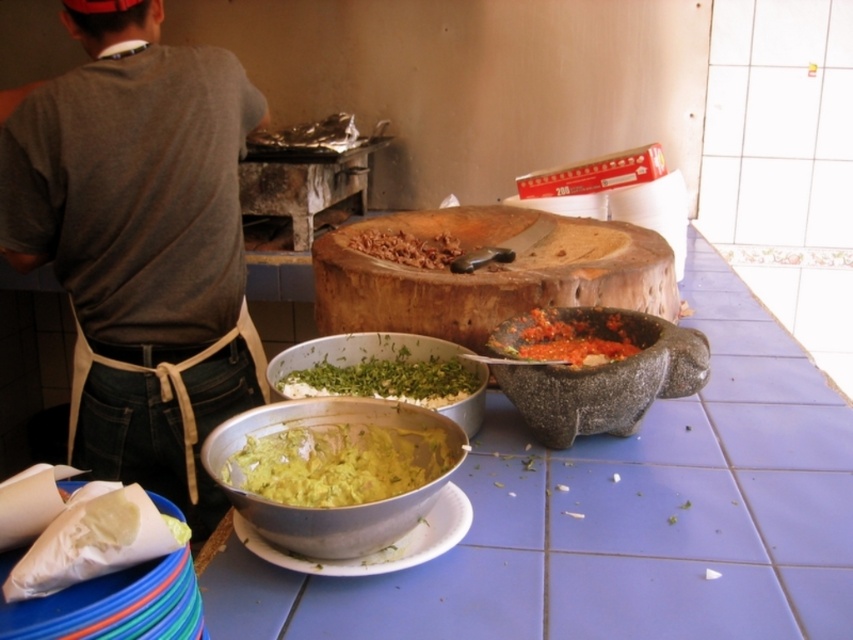
Question: Can you confirm if metallic silver bowl at center is thinner than white matte plate at center?

Choices:
 (A) yes
 (B) no

Answer: (B)

Question: Can you confirm if blue tile table at center is smaller than white matte plate at center?

Choices:
 (A) yes
 (B) no

Answer: (B)

Question: Can you confirm if yellowish-green paste at center is positioned above tomato paste stone mortar at center?

Choices:
 (A) yes
 (B) no

Answer: (B)

Question: Which of the following is the closest to the observer?

Choices:
 (A) blue tile table at center
 (B) metallic silver bowl at center

Answer: (B)

Question: Which is nearer to the metallic silver bowl at center?

Choices:
 (A) brown cotton shirt at upper left
 (B) blue tile table at center
 (C) white paper cone at lower left
 (D) green leafymaterial/texture at center

Answer: (C)

Question: Which is nearer to the tomato paste stone mortar at center?

Choices:
 (A) blue tile table at center
 (B) brown wooden chopping board at center
 (C) green leafymaterial/texture at center
 (D) yellowish-green paste at center

Answer: (C)